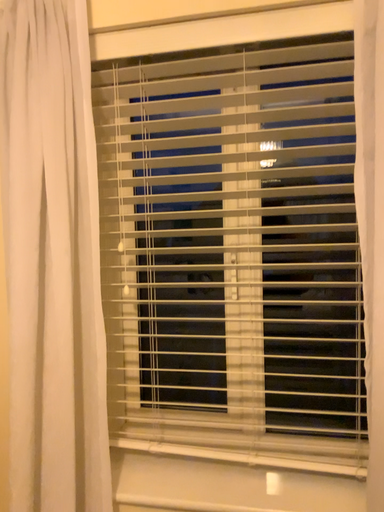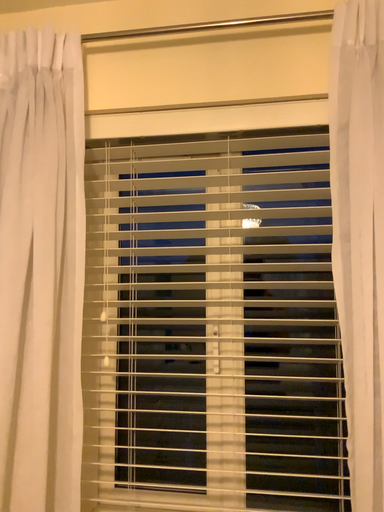
Question: Which way did the camera rotate in the video?

Choices:
 (A) rotated downward
 (B) rotated upward

Answer: (B)